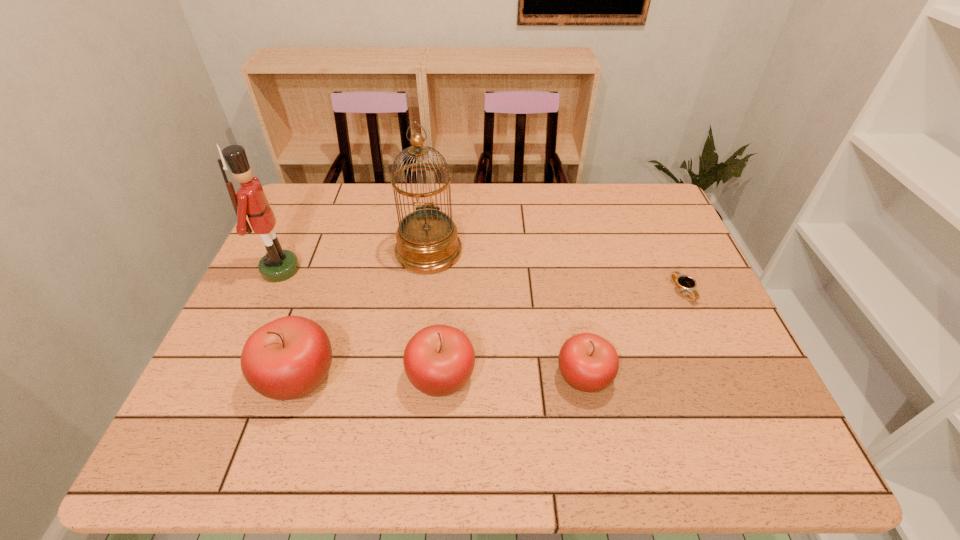
Where is `vacant space that satisfies the following two spatial constraints: 1. on the front-facing side of the leftmost object; 2. on the back side of the fourth tallest object`? vacant space that satisfies the following two spatial constraints: 1. on the front-facing side of the leftmost object; 2. on the back side of the fourth tallest object is located at coordinates (231, 377).

The height and width of the screenshot is (540, 960). Identify the location of free spot that satisfies the following two spatial constraints: 1. on the front-facing side of the leftmost object; 2. on the left side of the second object from right to left. (231, 376).

I want to click on vacant position in the image that satisfies the following two spatial constraints: 1. on the front-facing side of the leftmost apple; 2. on the left side of the leftmost object, so click(230, 377).

Find the location of a particular element. This screenshot has height=540, width=960. vacant space that satisfies the following two spatial constraints: 1. on the back side of the watch; 2. on the right side of the second tallest apple is located at coordinates (447, 291).

The height and width of the screenshot is (540, 960). In order to click on free region that satisfies the following two spatial constraints: 1. on the front-facing side of the nutcracker; 2. on the back side of the fifth object from right to left in this screenshot , I will do 230,377.

At what (x,y) coordinates should I click in order to perform the action: click on vacant space that satisfies the following two spatial constraints: 1. with an open door on the rightmost object; 2. on the left side of the birdcage. Please return your answer as a coordinate pair (x, y). Looking at the image, I should click on (424, 291).

Find the location of a particular element. This screenshot has width=960, height=540. vacant space that satisfies the following two spatial constraints: 1. on the front-facing side of the watch; 2. on the right side of the leftmost object is located at coordinates (271, 291).

Image resolution: width=960 pixels, height=540 pixels. Find the location of `vacant space that satisfies the following two spatial constraints: 1. on the front-facing side of the nutcracker; 2. on the back side of the second shortest object`. vacant space that satisfies the following two spatial constraints: 1. on the front-facing side of the nutcracker; 2. on the back side of the second shortest object is located at coordinates (231, 376).

Where is `free space that satisfies the following two spatial constraints: 1. on the front-facing side of the leftmost object; 2. on the right side of the second shortest object`? free space that satisfies the following two spatial constraints: 1. on the front-facing side of the leftmost object; 2. on the right side of the second shortest object is located at coordinates (231, 376).

Where is `free location that satisfies the following two spatial constraints: 1. with an open door on the watch; 2. on the left side of the birdcage`? free location that satisfies the following two spatial constraints: 1. with an open door on the watch; 2. on the left side of the birdcage is located at coordinates (424, 291).